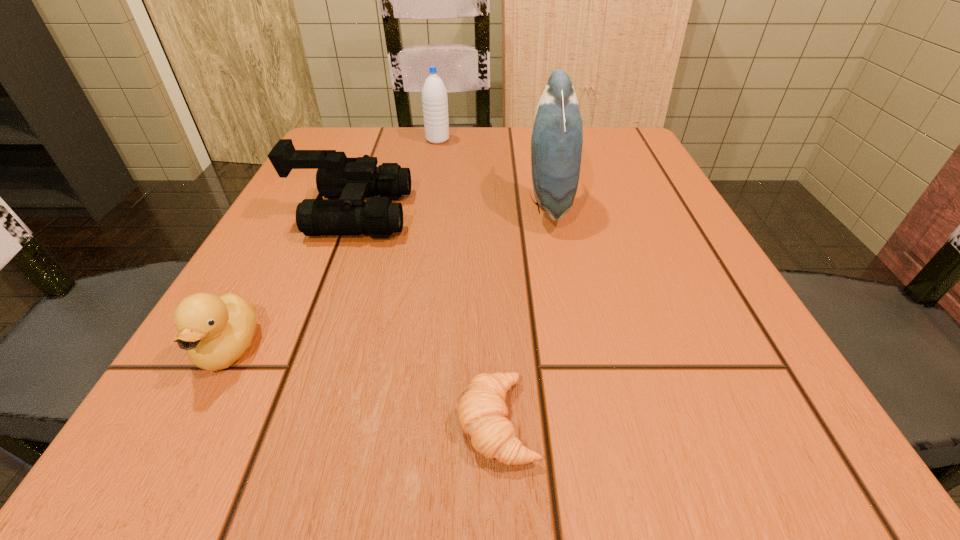
Identify the location of vacant area situated at the tip of the bird's beak. (345, 203).

This screenshot has width=960, height=540. What are the coordinates of `vacant area situated 0.220m on the right of the second tallest object` in the screenshot? It's located at (543, 139).

Locate an element on the screen. Image resolution: width=960 pixels, height=540 pixels. vacant space located on the front lenses of the third shortest object is located at coordinates (478, 213).

In order to click on vacant space located on the face of the duckling in this screenshot , I will do `click(171, 457)`.

Locate an element on the screen. Image resolution: width=960 pixels, height=540 pixels. free point located 0.060m on the right of the second object from right to left is located at coordinates (590, 422).

You are a GUI agent. You are given a task and a screenshot of the screen. Output one action in this format:
    pyautogui.click(x=<x>, y=<y>)
    Task: Click on the object located at the far edge
    The width and height of the screenshot is (960, 540).
    Given the screenshot: What is the action you would take?
    pyautogui.click(x=434, y=94)

Find the location of `object that is at the near edge`. object that is at the near edge is located at coordinates click(x=482, y=412).

Where is `binoculars that is at the left edge`? The width and height of the screenshot is (960, 540). binoculars that is at the left edge is located at coordinates (351, 180).

Locate an element on the screen. The width and height of the screenshot is (960, 540). duckling that is at the left edge is located at coordinates (215, 331).

Locate an element on the screen. free space at the far edge is located at coordinates (393, 154).